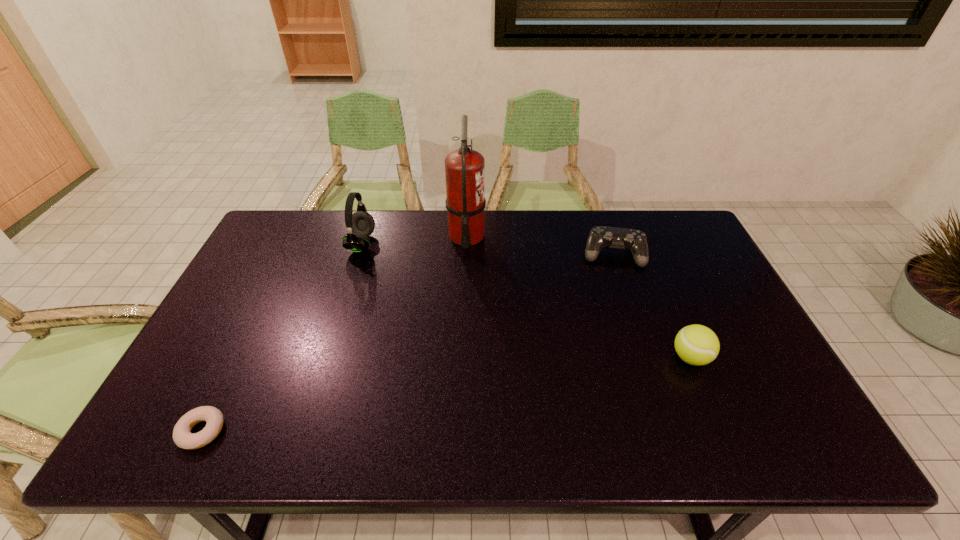
This screenshot has width=960, height=540. What are the coordinates of `the tallest object` in the screenshot? It's located at (464, 168).

Image resolution: width=960 pixels, height=540 pixels. In order to click on fire extinguisher in this screenshot , I will do click(464, 168).

Locate an element on the screen. The width and height of the screenshot is (960, 540). the second object from left to right is located at coordinates (360, 225).

The height and width of the screenshot is (540, 960). I want to click on headset, so click(x=360, y=225).

You are a GUI agent. You are given a task and a screenshot of the screen. Output one action in this format:
    pyautogui.click(x=<x>, y=<y>)
    Task: Click on the third tallest object
    
    Given the screenshot: What is the action you would take?
    pyautogui.click(x=698, y=345)

Locate an element on the screen. the fourth farthest object is located at coordinates (698, 345).

The height and width of the screenshot is (540, 960). Find the location of `control`. control is located at coordinates (620, 238).

This screenshot has height=540, width=960. I want to click on the shortest object, so click(182, 436).

Image resolution: width=960 pixels, height=540 pixels. What are the coordinates of `the leftmost object` in the screenshot? It's located at (182, 436).

This screenshot has width=960, height=540. What are the coordinates of `free space located toward the nozzle of the fire extinguisher` in the screenshot? It's located at 586,236.